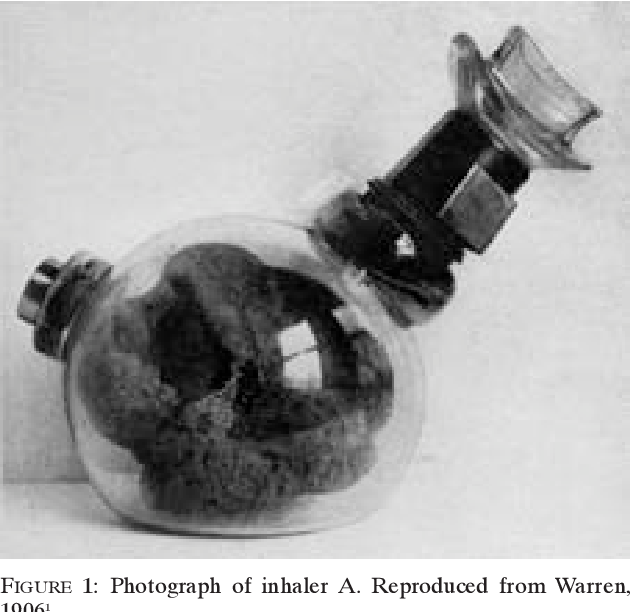
You are a GUI agent. You are given a task and a screenshot of the screen. Output one action in this format:
    pyautogui.click(x=<x>, y=<y>)
    Task: Click on the glass
    This screenshot has width=632, height=612.
    Given the screenshot: What is the action you would take?
    pyautogui.click(x=410, y=416)